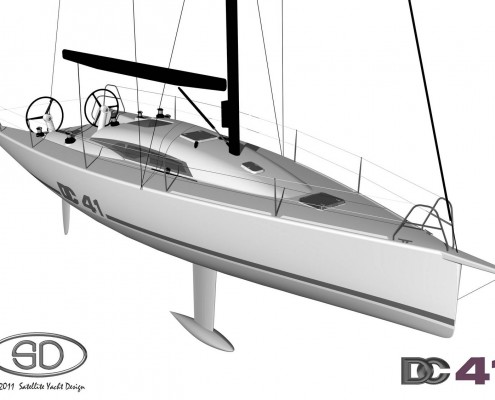
Where is `cables`? cables is located at coordinates (417, 47), (287, 30), (260, 36), (179, 28), (131, 16), (56, 13).